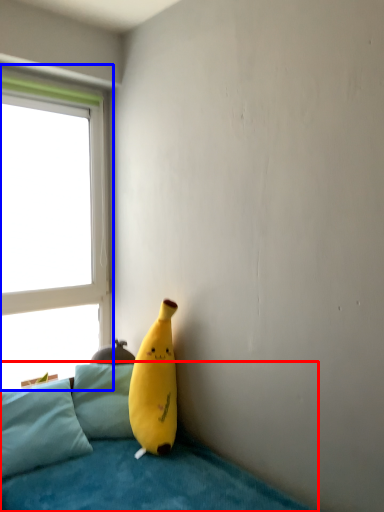
Question: Which point is further to the camera, studio couch (highlighted by a red box) or window (highlighted by a blue box)?

Choices:
 (A) studio couch
 (B) window

Answer: (B)